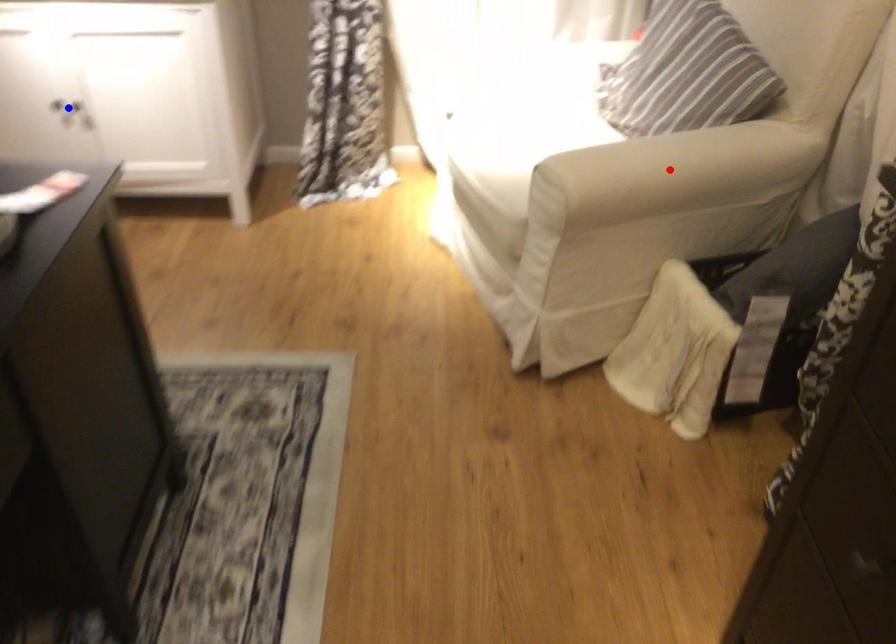
Question: Two points are marked on the image. Which point is closer to the camera?

Choices:
 (A) Blue point is closer.
 (B) Red point is closer.

Answer: (B)